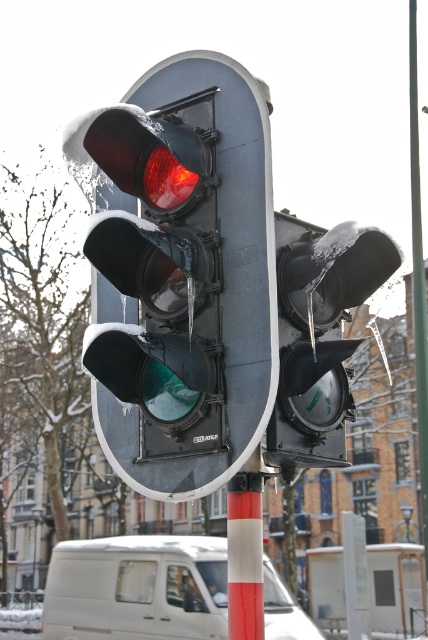
In the scene shown: Does matte black traffic light at center lie in front of white matte van at lower center?

Yes, matte black traffic light at center is closer to the viewer.

Is point (190, 253) behind point (98, 544)?

That is False.

This screenshot has height=640, width=428. Find the location of `matte black traffic light at center`. matte black traffic light at center is located at coordinates (186, 276).

Does red/white painted pole at center come in front of white plastic sign at center?

Yes, red/white painted pole at center is closer to the viewer.

Looking at this image, can you confirm if red/white painted pole at center is bigger than white plastic sign at center?

No, red/white painted pole at center is not bigger than white plastic sign at center.

The image size is (428, 640). Find the location of `red/white painted pole at center`. red/white painted pole at center is located at coordinates (244, 552).

Can you confirm if matte black traffic light at center is positioned below transparent ice-covered traffic light at center?

No, matte black traffic light at center is not below transparent ice-covered traffic light at center.

Does matte black traffic light at center have a lesser height compared to transparent ice-covered traffic light at center?

No.

Does point (166, 340) come in front of point (360, 259)?

That is True.

Image resolution: width=428 pixels, height=640 pixels. In order to click on matte black traffic light at center in this screenshot , I will do `click(186, 276)`.